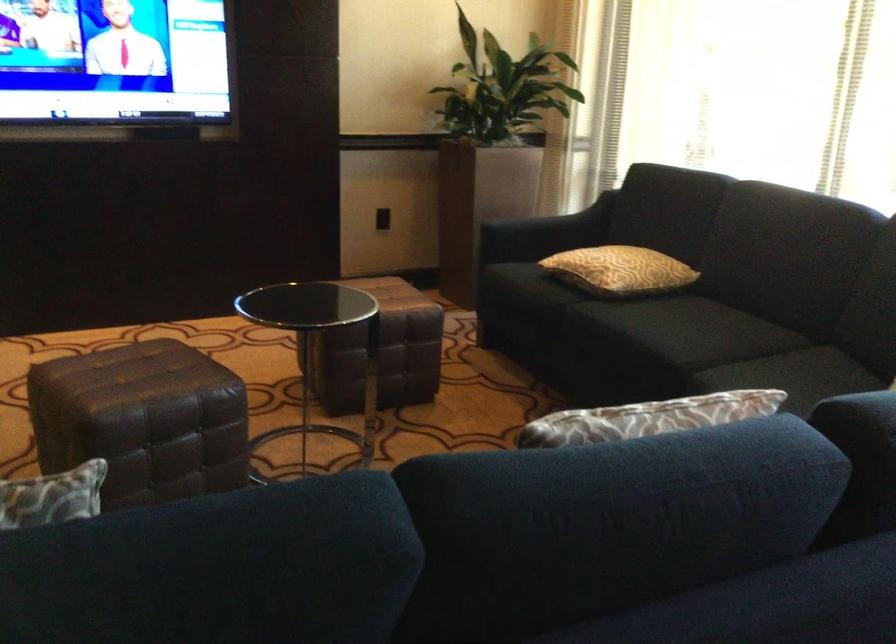
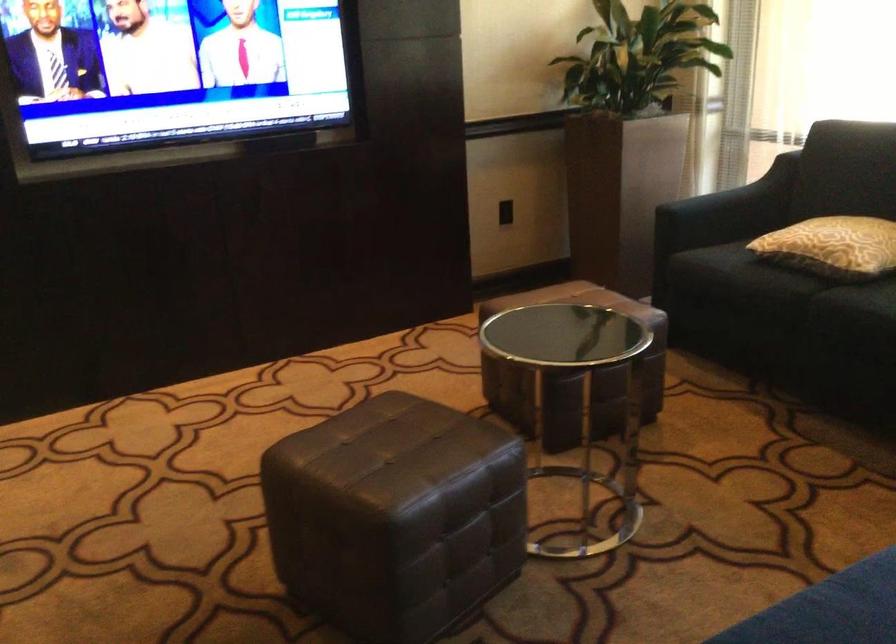
Where in the second image is the point corresponding to pixel 116 422 from the first image?

(394, 516)